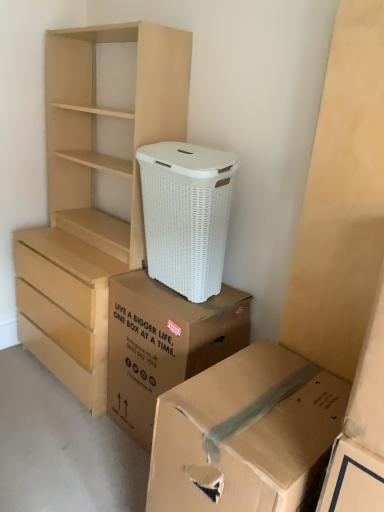
Question: Does white wicker laundry basket at center have a lesser width compared to cardboard box at lower right, acting as the second box starting from the back?

Choices:
 (A) no
 (B) yes

Answer: (B)

Question: Is white wicker laundry basket at center positioned behind cardboard box at lower right, the 1th box from the front?

Choices:
 (A) yes
 (B) no

Answer: (A)

Question: Is the depth of white wicker laundry basket at center less than that of cardboard box at lower right, the 1th box from the front?

Choices:
 (A) no
 (B) yes

Answer: (A)

Question: Is white wicker laundry basket at center positioned far away from cardboard box at lower right, acting as the second box starting from the back?

Choices:
 (A) no
 (B) yes

Answer: (A)

Question: Is white wicker laundry basket at center facing away from cardboard box at lower right, acting as the second box starting from the back?

Choices:
 (A) no
 (B) yes

Answer: (A)

Question: Does white wicker laundry basket at center have a larger size compared to cardboard box at lower right, acting as the second box starting from the back?

Choices:
 (A) no
 (B) yes

Answer: (A)

Question: Does light brown wood chest of drawers at left have a smaller size compared to white wicker laundry basket at center?

Choices:
 (A) yes
 (B) no

Answer: (B)

Question: Does light brown wood chest of drawers at left have a lesser height compared to white wicker laundry basket at center?

Choices:
 (A) yes
 (B) no

Answer: (B)

Question: Is light brown wood chest of drawers at left not within white wicker laundry basket at center?

Choices:
 (A) no
 (B) yes

Answer: (B)

Question: Does light brown wood chest of drawers at left lie in front of white wicker laundry basket at center?

Choices:
 (A) no
 (B) yes

Answer: (A)

Question: Is light brown wood chest of drawers at left positioned behind white wicker laundry basket at center?

Choices:
 (A) yes
 (B) no

Answer: (A)

Question: From a real-world perspective, is light brown wood chest of drawers at left below white wicker laundry basket at center?

Choices:
 (A) yes
 (B) no

Answer: (A)

Question: Considering the relative sizes of cardboard box at lower right, acting as the second box starting from the back, and white wicker laundry basket at center in the image provided, is cardboard box at lower right, acting as the second box starting from the back, bigger than white wicker laundry basket at center?

Choices:
 (A) yes
 (B) no

Answer: (A)